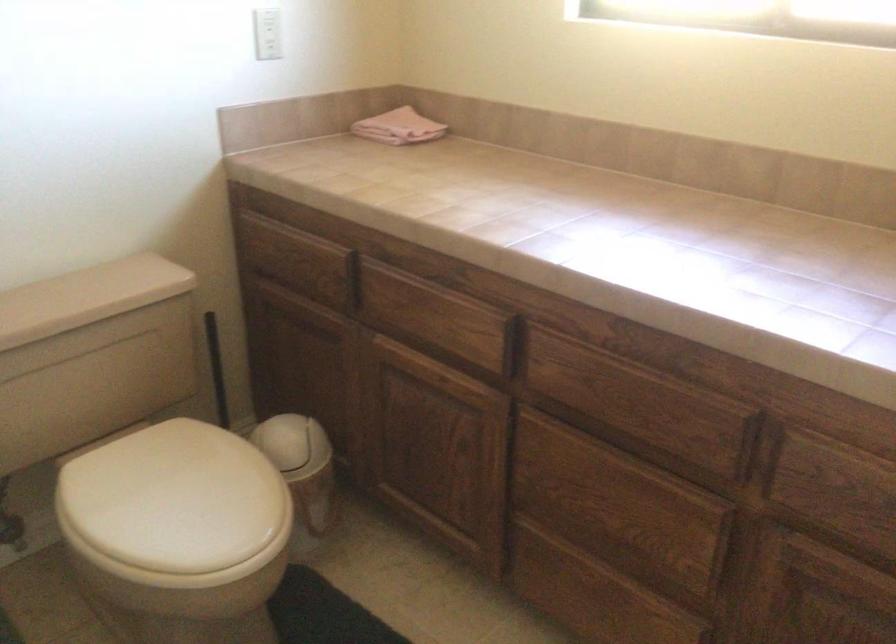
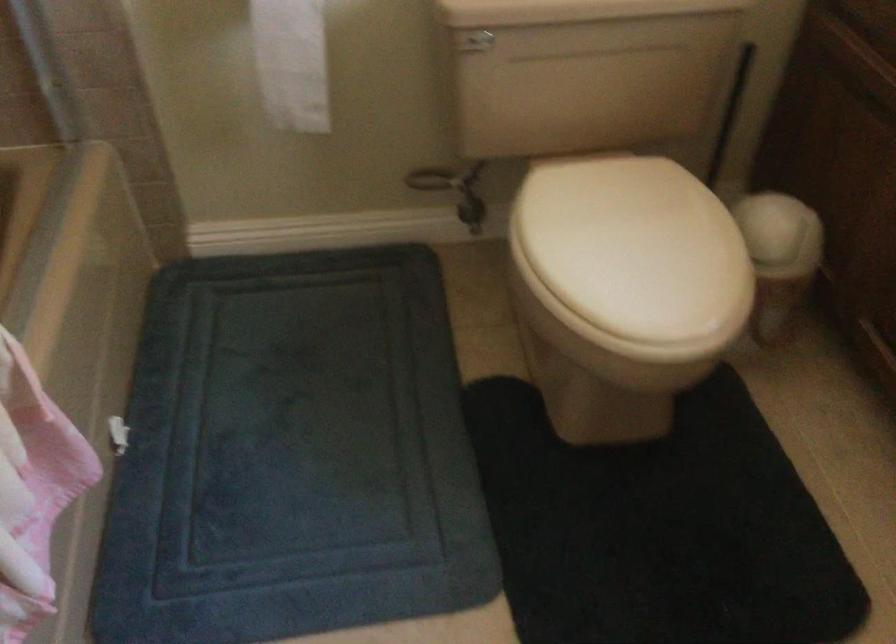
Find the pixel in the second image that matches point (300, 446) in the first image.

(780, 234)